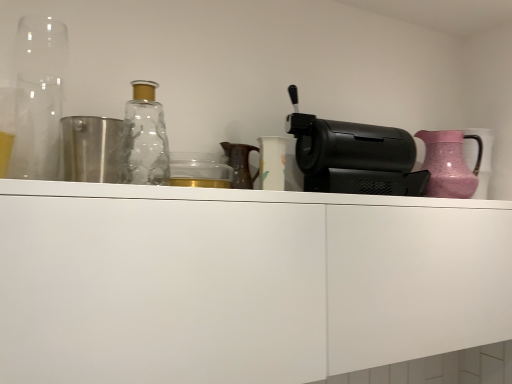
Question: Does pink textured jug at right contain black plastic coffee machine at right?

Choices:
 (A) no
 (B) yes

Answer: (A)

Question: Is pink textured jug at right at the left side of black plastic coffee machine at right?

Choices:
 (A) yes
 (B) no

Answer: (B)

Question: Does pink textured jug at right have a lesser width compared to black plastic coffee machine at right?

Choices:
 (A) yes
 (B) no

Answer: (B)

Question: Is pink textured jug at right at the right side of black plastic coffee machine at right?

Choices:
 (A) yes
 (B) no

Answer: (A)

Question: From the image's perspective, is pink textured jug at right over black plastic coffee machine at right?

Choices:
 (A) yes
 (B) no

Answer: (B)

Question: In terms of size, does transparent glass at left appear bigger or smaller than pink textured jug at right?

Choices:
 (A) big
 (B) small

Answer: (A)

Question: Is transparent glass at left in front of or behind pink textured jug at right in the image?

Choices:
 (A) behind
 (B) front

Answer: (B)

Question: From a real-world perspective, relative to pink textured jug at right, is transparent glass at left vertically above or below?

Choices:
 (A) below
 (B) above

Answer: (B)

Question: In terms of width, does transparent glass at left look wider or thinner when compared to pink textured jug at right?

Choices:
 (A) thin
 (B) wide

Answer: (A)

Question: Based on their sizes in the image, would you say transparent glass bottle at upper left is bigger or smaller than black plastic coffee machine at right?

Choices:
 (A) big
 (B) small

Answer: (B)

Question: In the image, is transparent glass bottle at upper left positioned in front of or behind black plastic coffee machine at right?

Choices:
 (A) front
 (B) behind

Answer: (A)

Question: Considering the relative positions of transparent glass bottle at upper left and black plastic coffee machine at right in the image provided, is transparent glass bottle at upper left to the left or to the right of black plastic coffee machine at right?

Choices:
 (A) right
 (B) left

Answer: (B)

Question: From a real-world perspective, is transparent glass bottle at upper left physically located above or below black plastic coffee machine at right?

Choices:
 (A) below
 (B) above

Answer: (A)

Question: Is point (46, 107) closer or farther from the camera than point (501, 271)?

Choices:
 (A) farther
 (B) closer

Answer: (B)

Question: From the image's perspective, is transparent glass at left positioned above or below white matte cabinet at center?

Choices:
 (A) above
 (B) below

Answer: (A)